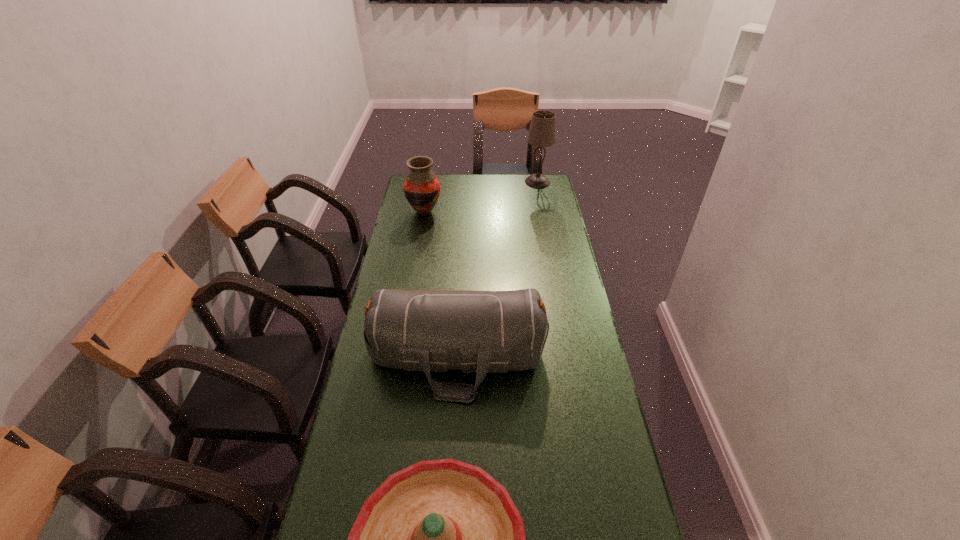
I want to click on the farthest object, so point(542,133).

Find the location of a particular element. The image size is (960, 540). the tallest object is located at coordinates (542, 133).

Where is `vase`? vase is located at coordinates (421, 187).

The height and width of the screenshot is (540, 960). In order to click on duffel bag in this screenshot , I will do `click(485, 332)`.

Identify the location of free space located on the front-facing side of the tallest object. (495, 182).

Image resolution: width=960 pixels, height=540 pixels. What are the coordinates of `free space located on the front-facing side of the tallest object` in the screenshot? It's located at (497, 182).

You are a GUI agent. You are given a task and a screenshot of the screen. Output one action in this format:
    pyautogui.click(x=<x>, y=<y>)
    Task: Click on the vacant space located 0.370m on the front-facing side of the tallest object
    
    Given the screenshot: What is the action you would take?
    pyautogui.click(x=453, y=182)

Locate an element on the screen. Image resolution: width=960 pixels, height=540 pixels. vacant position located 0.140m on the right of the vase is located at coordinates (471, 212).

Where is `free space located 0.070m on the right of the duffel bag`? This screenshot has height=540, width=960. free space located 0.070m on the right of the duffel bag is located at coordinates (568, 357).

This screenshot has height=540, width=960. Find the location of `object located at the far edge`. object located at the far edge is located at coordinates (542, 133).